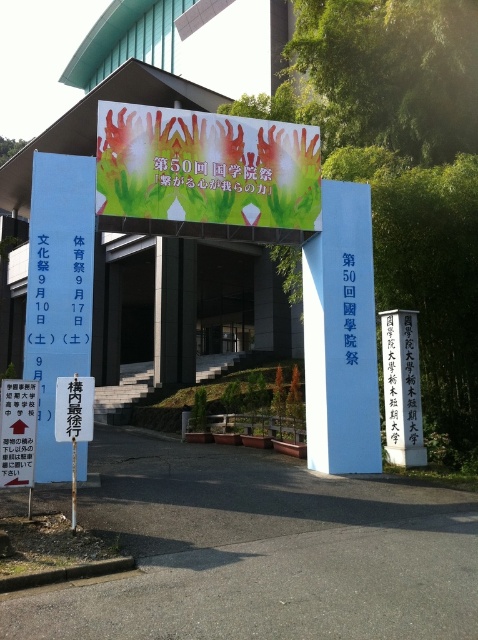
Is blue smooth sign at center wider than white stone sign at center?

Correct, the width of blue smooth sign at center exceeds that of white stone sign at center.

At what (x,y) coordinates should I click in order to perform the action: click on blue smooth sign at center. Please return your answer as a coordinate pair (x, y). Looking at the image, I should click on (340, 336).

Which is behind, point (305, 340) or point (382, 323)?

Point (382, 323)

This screenshot has width=478, height=640. I want to click on blue smooth sign at center, so click(340, 336).

Between point (125, 132) and point (322, 323), which one is positioned in front?

Positioned in front is point (125, 132).

Between green painted banner at center and blue smooth sign at center, which one is positioned higher?

green painted banner at center is above.

Does point (270, 212) lie in front of point (328, 269)?

Yes, point (270, 212) is closer to viewer.

This screenshot has height=640, width=478. What are the coordinates of `green painted banner at center` in the screenshot? It's located at (206, 168).

Which of these two, green painted banner at center or white paper sign at center, stands taller?

green painted banner at center

At what (x,y) coordinates should I click in order to perform the action: click on green painted banner at center. Please return your answer as a coordinate pair (x, y). This screenshot has width=478, height=640. Looking at the image, I should click on (206, 168).